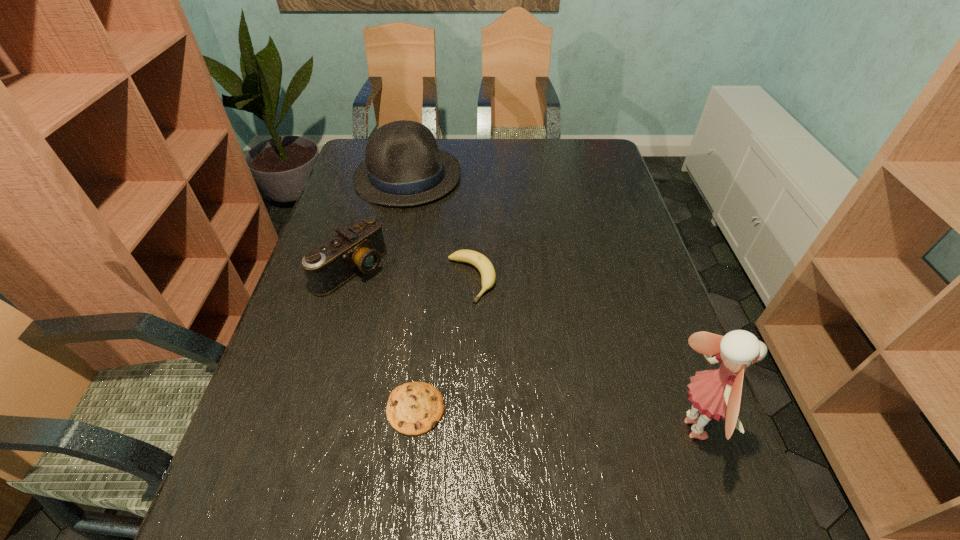
Locate an element on the screen. The image size is (960, 540). free space on the desktop that is between the shortest object and the tallest object and is positioned at the stem of the fourth tallest object is located at coordinates (569, 420).

Image resolution: width=960 pixels, height=540 pixels. I want to click on vacant spot on the desktop that is between the shortest object and the doll and is positioned on the lens of the camera, so click(575, 421).

I want to click on free space on the desktop that is between the cookie and the tallest object and is positioned on the front-facing side of the farthest object, so [x=540, y=418].